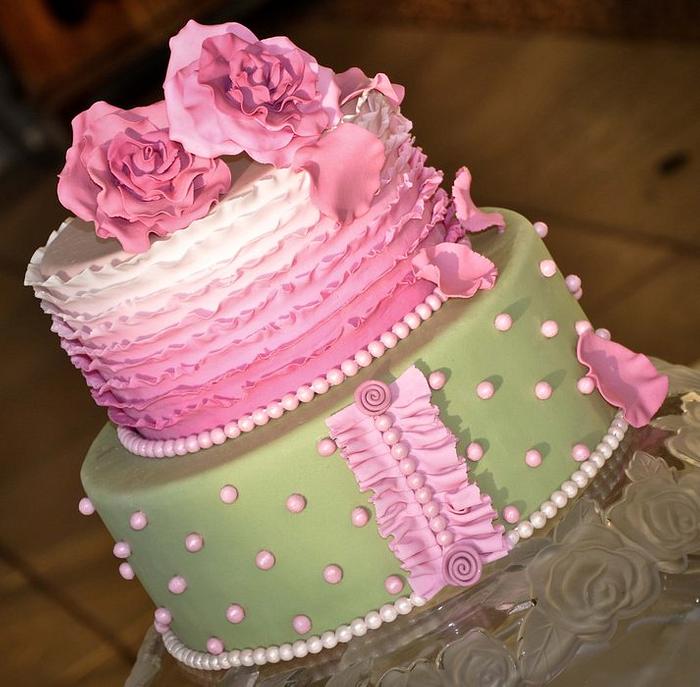
This screenshot has height=687, width=700. I want to click on pink pearl decor, so click(495, 319).